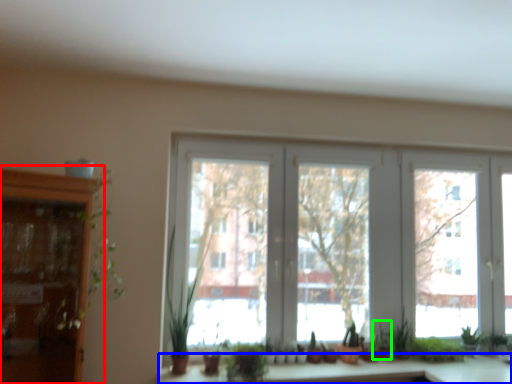
Question: Estimate the real-world distances between objects in this image. Which object is closer to cabinetry (highlighted by a red box), counter top (highlighted by a blue box) or plant (highlighted by a green box)?

Choices:
 (A) counter top
 (B) plant

Answer: (A)